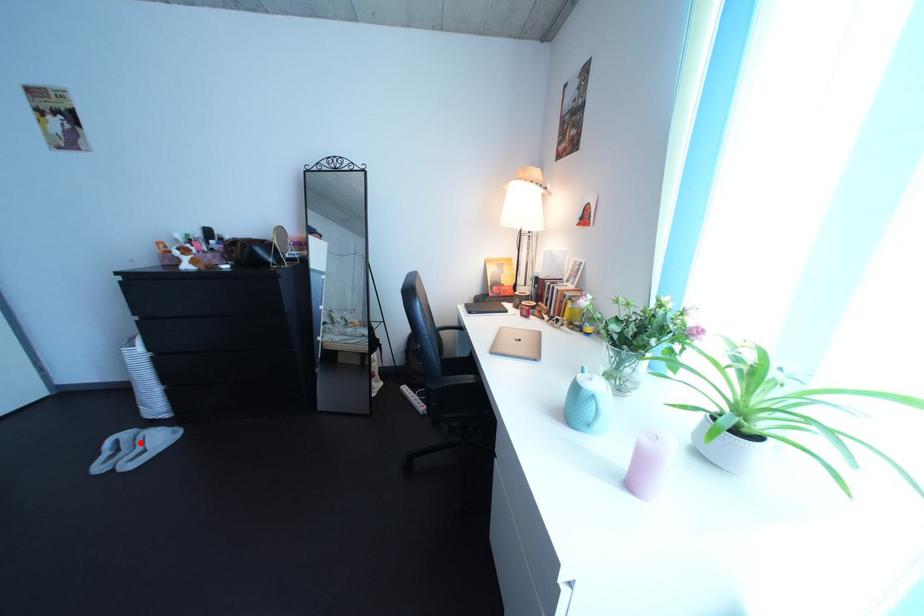
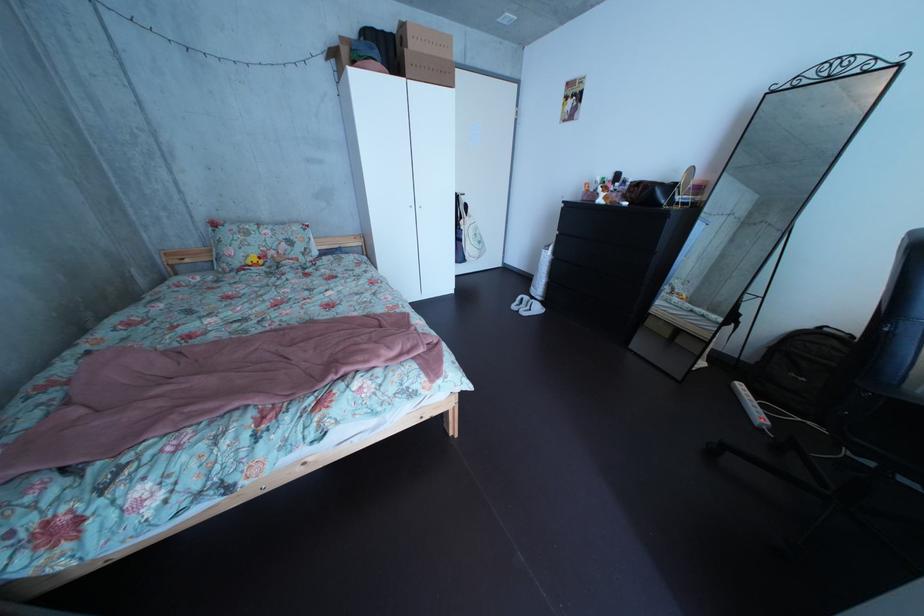
Locate, in the second image, the point that corresponds to the highlighted location in the first image.

(541, 306)